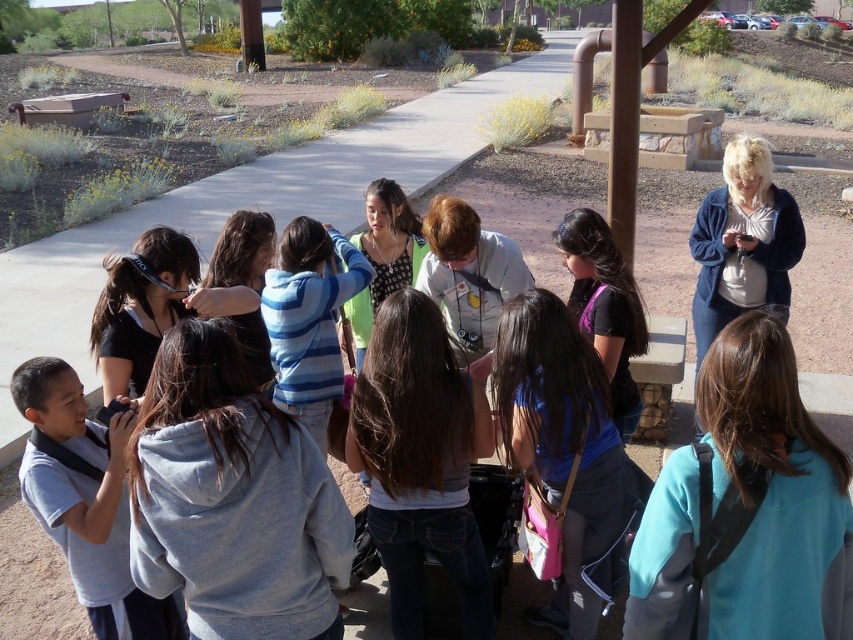
Question: Does light brown hair at center have a greater width compared to black matte shirt at center?

Choices:
 (A) no
 (B) yes

Answer: (B)

Question: Considering the relative positions of blue fabric backpack at center and light brown hair at center in the image provided, where is blue fabric backpack at center located with respect to light brown hair at center?

Choices:
 (A) above
 (B) below

Answer: (B)

Question: Which object is the farthest from the blue fabric backpack at center?

Choices:
 (A) black matte shirt at center
 (B) white cotton shirt at upper right

Answer: (B)

Question: Which object is farther from the camera taking this photo?

Choices:
 (A) gray fleece hoodie at center
 (B) black matte shirt at center
 (C) light blue fabric backpack at lower right
 (D) blue striped hoodie at center

Answer: (D)

Question: Observing the image, what is the correct spatial positioning of blue fabric backpack at center in reference to white cotton shirt at upper right?

Choices:
 (A) left
 (B) right

Answer: (A)

Question: Considering the real-world distances, which object is closest to the white cotton shirt at upper right?

Choices:
 (A) smooth gray hoodie at center
 (B) blue striped hoodie at center
 (C) black matte shirt at center
 (D) blue fabric backpack at center

Answer: (C)